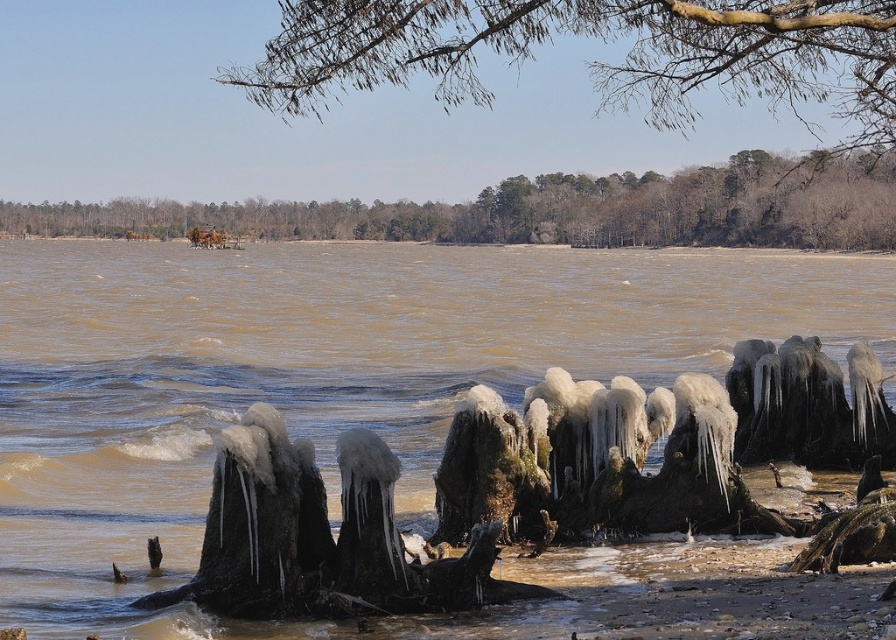
You are an artist sketching the riverside scene. You notice two elements at the upper center of your drawing. Which one is positioned to the right when comparing the bare branches at upper center and the brown wood trees at upper center?

The bare branches at upper center are positioned to the right of the brown wood trees at upper center.

You are an environmental scientist examining the riverside scene. You notice the brown wood trees at upper center and the brown muddy water at center. Based on their positions, which object is located to the left of the other?

The brown wood trees at upper center are to the left of the brown muddy water at center because the brown muddy water at center is to the right of brown wood trees at upper center.

You are standing on the riverside path and want to take a photo of the brown muddy water at center and the brown wood trees at upper center. Which object will appear larger in the photo?

The brown muddy water at center will appear larger in the photo because it is closer to the camera than the brown wood trees at upper center.